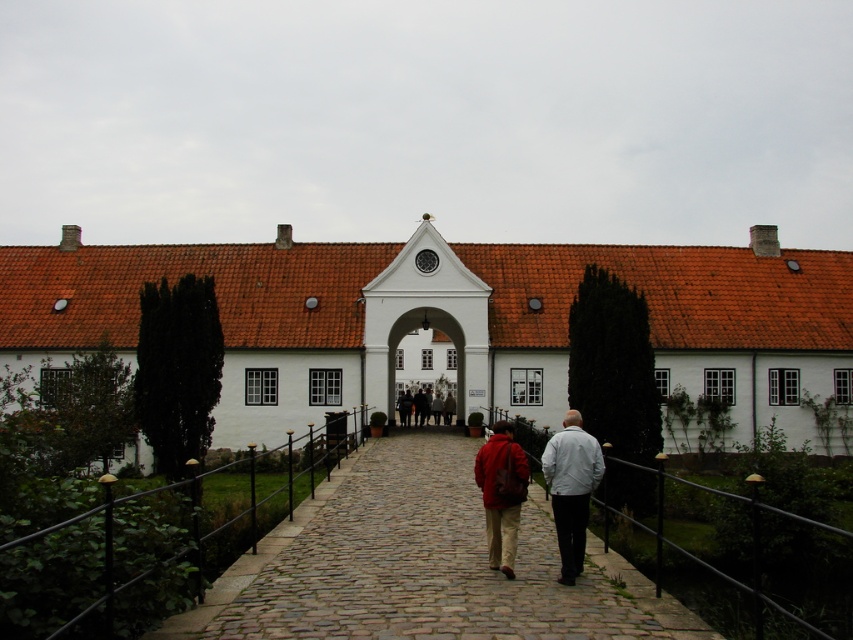
The width and height of the screenshot is (853, 640). What do you see at coordinates (572, 488) in the screenshot?
I see `white matte jacket at center` at bounding box center [572, 488].

Between point (558, 538) and point (410, 346), which one is positioned in front?

Point (558, 538) is more forward.

Is point (577, 458) positioned in front of point (395, 388)?

Yes, it is.

Find the location of a particular element. Image resolution: width=853 pixels, height=640 pixels. white matte jacket at center is located at coordinates (572, 488).

Does matte red jacket at center appear under white stone archway at center?

Yes, matte red jacket at center is below white stone archway at center.

Between point (488, 483) and point (416, 356), which one is positioned in front?

Point (488, 483)

Image resolution: width=853 pixels, height=640 pixels. Find the location of `matte red jacket at center`. matte red jacket at center is located at coordinates (498, 493).

Is the position of cobblestone path at center less distant than that of white matte jacket at center?

That is True.

Does cobblestone path at center have a greater width compared to white matte jacket at center?

Correct, the width of cobblestone path at center exceeds that of white matte jacket at center.

Is point (311, 588) closer to viewer compared to point (561, 577)?

Yes, it is.

Locate an element on the screen. This screenshot has width=853, height=640. cobblestone path at center is located at coordinates (421, 564).